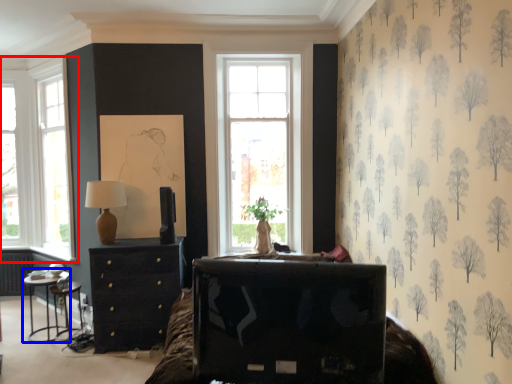
Question: Which object is closer to the camera taking this photo, window (highlighted by a red box) or table (highlighted by a blue box)?

Choices:
 (A) window
 (B) table

Answer: (B)